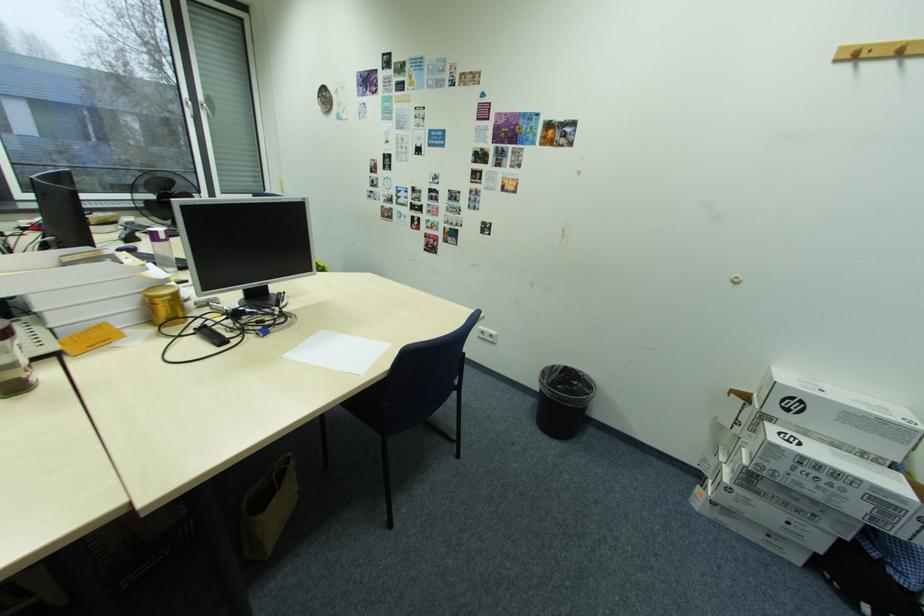
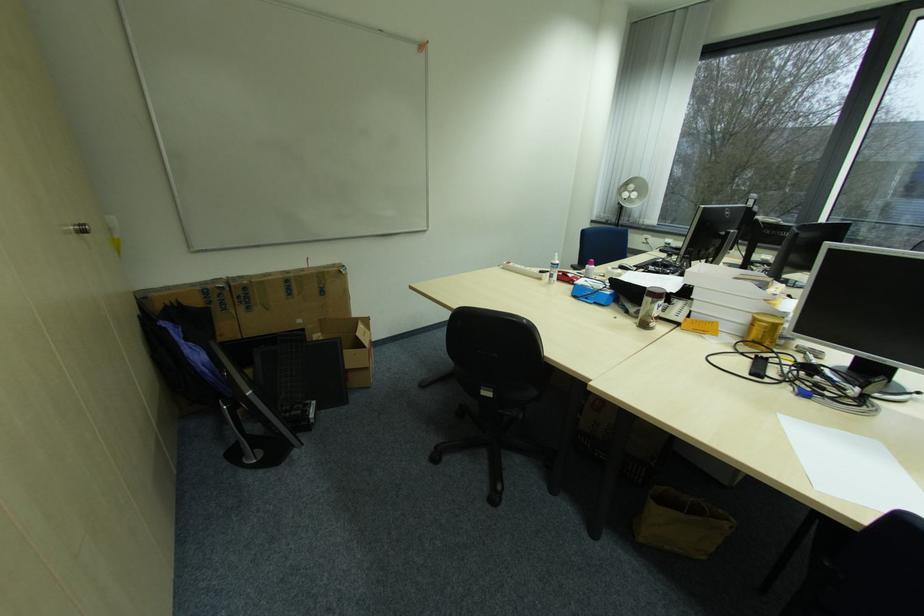
Where in the second image is the point corresponding to point (177, 301) from the first image?

(773, 329)